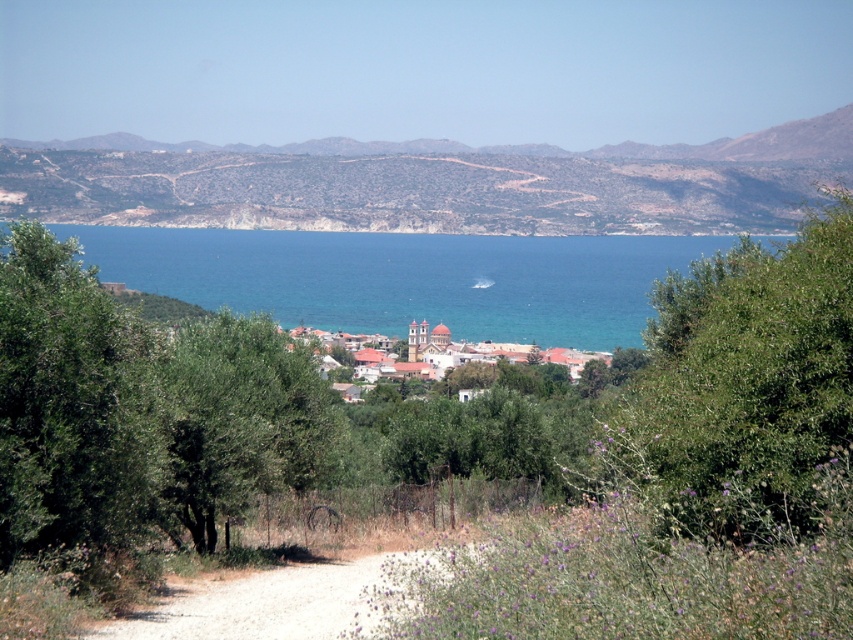
Does dirt/gravel path at center have a lesser width compared to white stucco buildings at center?

Indeed, dirt/gravel path at center has a lesser width compared to white stucco buildings at center.

Is dirt/gravel path at center taller than white stucco buildings at center?

No, dirt/gravel path at center is not taller than white stucco buildings at center.

I want to click on dirt/gravel path at center, so click(x=291, y=602).

Who is more forward, (850, 172) or (679, 481)?

Positioned in front is point (679, 481).

Can you confirm if brown/dry grassy hill at upper center is bigger than green leafy bush at right?

Yes, brown/dry grassy hill at upper center is bigger than green leafy bush at right.

Is point (47, 150) more distant than point (675, 428)?

Yes, it is.

Locate an element on the screen. The height and width of the screenshot is (640, 853). brown/dry grassy hill at upper center is located at coordinates (433, 182).

From the picture: Does green leafy bush at right have a larger size compared to white stucco buildings at center?

No, green leafy bush at right is not bigger than white stucco buildings at center.

Looking at this image, which is above, green leafy bush at right or white stucco buildings at center?

green leafy bush at right is above.

Is point (694, 451) positioned after point (410, 326)?

No, it is not.

This screenshot has width=853, height=640. In order to click on green leafy bush at right in this screenshot , I will do `click(744, 387)`.